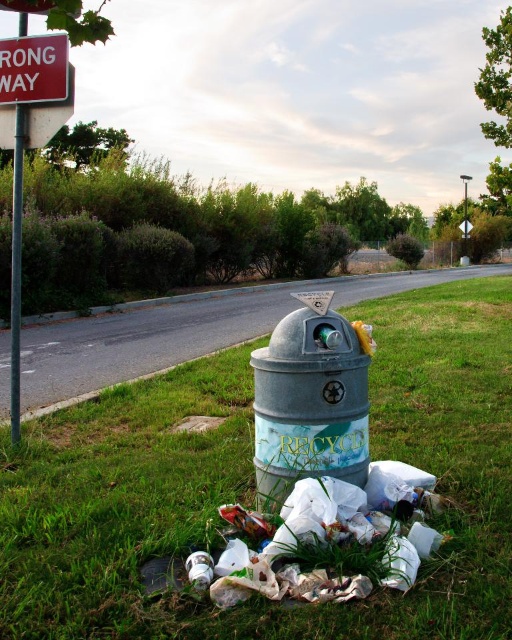
Question: Which point is closer to the camera taking this photo?

Choices:
 (A) (14, 371)
 (B) (229, 588)
 (C) (19, 70)

Answer: (B)

Question: Is white plastic bags at lower center to the left of red plastic sign at upper left from the viewer's perspective?

Choices:
 (A) no
 (B) yes

Answer: (A)

Question: Is green grass at lower center thinner than red plastic sign at upper left?

Choices:
 (A) no
 (B) yes

Answer: (A)

Question: Which object is farther from the camera taking this photo?

Choices:
 (A) metallic pole at left
 (B) white plastic bags at lower center
 (C) red plastic sign at upper left

Answer: (A)

Question: Which object is the farthest from the red plastic sign at upper left?

Choices:
 (A) metallic pole at left
 (B) white plastic bags at lower center
 (C) green grass at lower center

Answer: (B)

Question: Is white plastic bags at lower center to the left of metallic pole at left from the viewer's perspective?

Choices:
 (A) yes
 (B) no

Answer: (B)